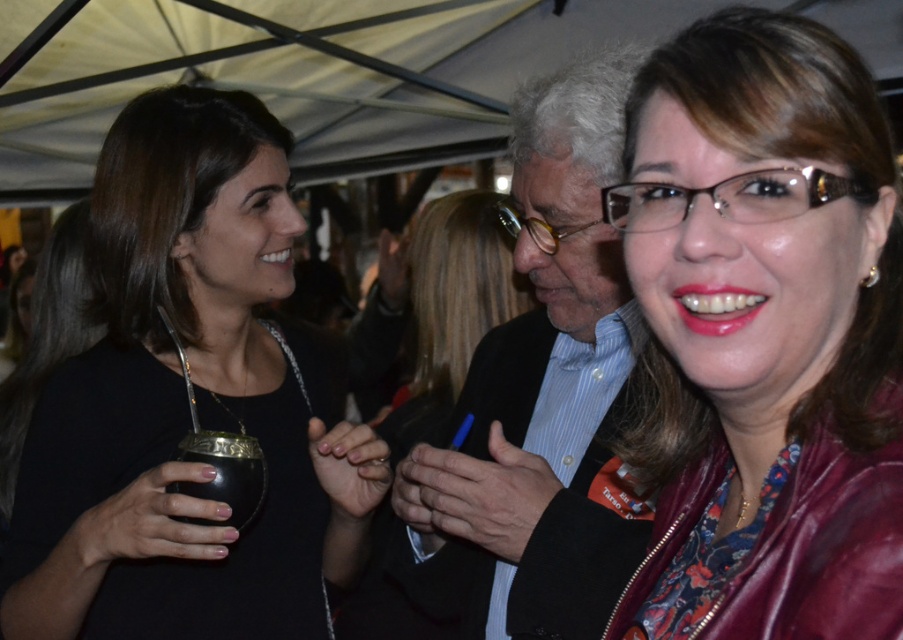
You are at an outdoor fair and see two items in front of you. One is the black matte mate cup at left and the other is the matte black suit at center. Which item is located to the right of the other?

The matte black suit at center is located to the right of the black matte mate cup at left.

You are a photographer standing at the back of the tent. You want to take a photo of the matte black jacket at center and the black matte mate cup at lower left. Can you fit both items in the frame if your camera has a minimum focus distance of 20 inches?

The distance between the matte black jacket at center and the black matte mate cup at lower left is 21.73 inches. Since the camera requires a minimum focus distance of 20 inches, the photographer can capture both items in the frame as the distance between them exceeds the required minimum focus distance.